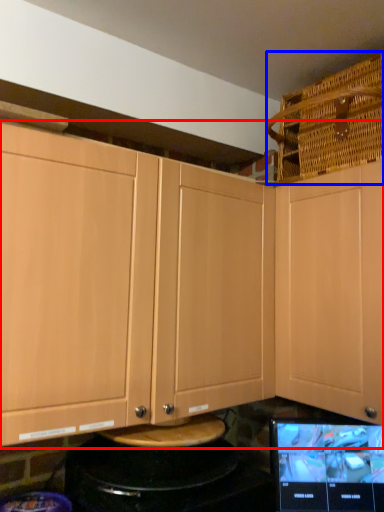
Question: Among these objects, which one is nearest to the camera, cabinetry (highlighted by a red box) or basket (highlighted by a blue box)?

Choices:
 (A) cabinetry
 (B) basket

Answer: (A)